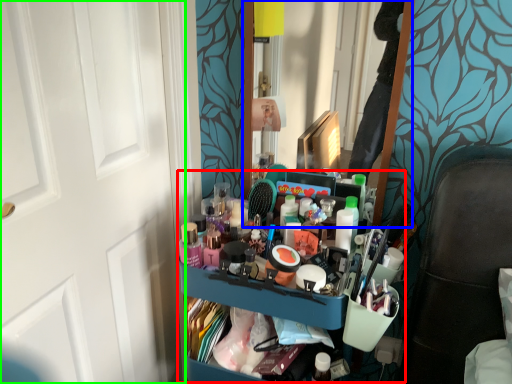
Question: Which object is positioned closest to bookshelf (highlighted by a red box)? Select from mirror (highlighted by a blue box) and door (highlighted by a green box).

Choices:
 (A) mirror
 (B) door

Answer: (B)